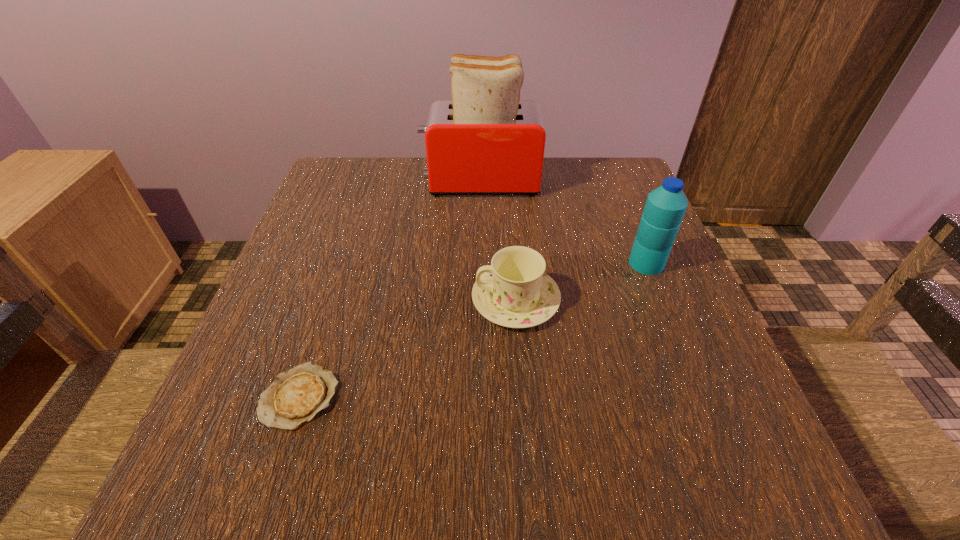
Identify the location of vacant space at the left edge. (351, 268).

Identify the location of free region at the right edge of the desktop. (696, 357).

Identify the location of free spot at the near left corner of the desktop. (170, 505).

This screenshot has height=540, width=960. Identify the location of free spot at the far right corner of the desktop. (631, 186).

This screenshot has height=540, width=960. What are the coordinates of `free space between the rightmost object and the chinaware` in the screenshot? It's located at (581, 282).

At what (x,y) coordinates should I click in order to perform the action: click on free spot between the nearest object and the tallest object. Please return your answer as a coordinate pair (x, y). Looking at the image, I should click on (390, 289).

Find the location of a particular element. vacant space that's between the nearest object and the second shortest object is located at coordinates (408, 348).

At what (x,y) coordinates should I click in order to perform the action: click on blank region between the chinaware and the nearest object. Please return your answer as a coordinate pair (x, y). Image resolution: width=960 pixels, height=540 pixels. Looking at the image, I should click on (408, 348).

This screenshot has width=960, height=540. In order to click on free space between the shortest object and the water bottle in this screenshot , I will do `click(473, 329)`.

The width and height of the screenshot is (960, 540). I want to click on vacant space that's between the second shortest object and the tallest object, so click(498, 241).